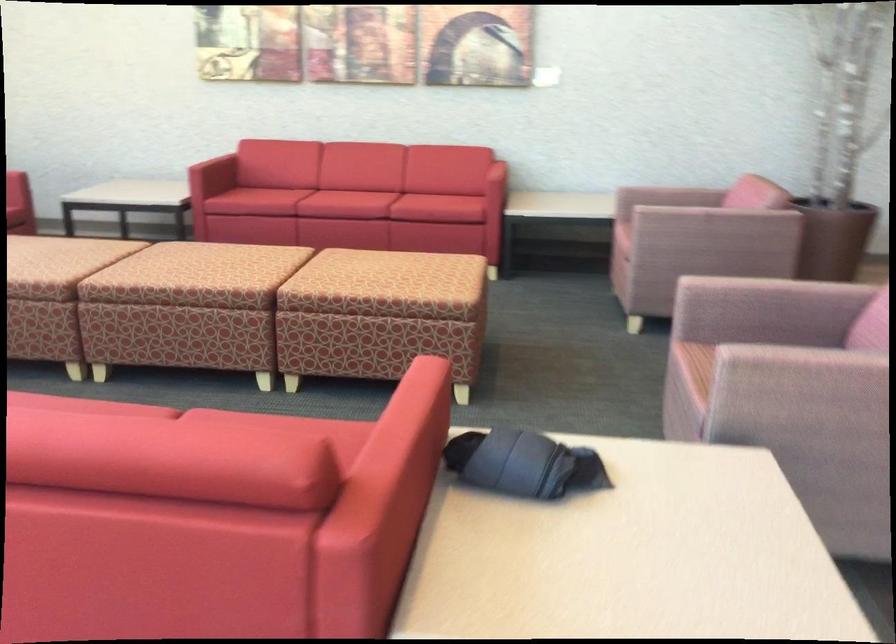
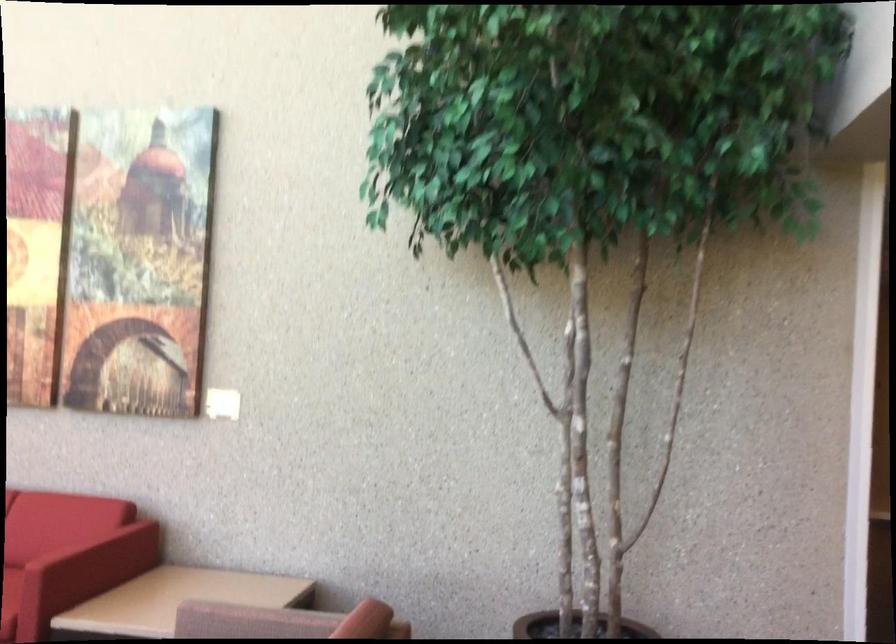
In the second image, find the point that corresponds to pixel 474 156 in the first image.

(80, 540)